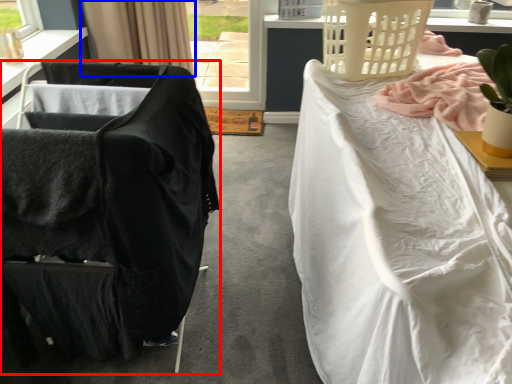
Question: Which of the following is the farthest to the observer, chair (highlighted by a red box) or curtain (highlighted by a blue box)?

Choices:
 (A) chair
 (B) curtain

Answer: (B)